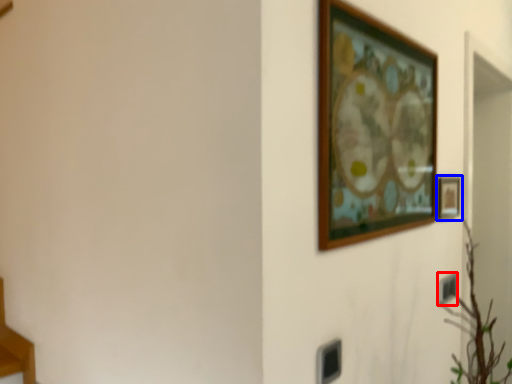
Question: Which point is closer to the camera, electric outlet (highlighted by a red box) or picture frame (highlighted by a blue box)?

Choices:
 (A) electric outlet
 (B) picture frame

Answer: (B)